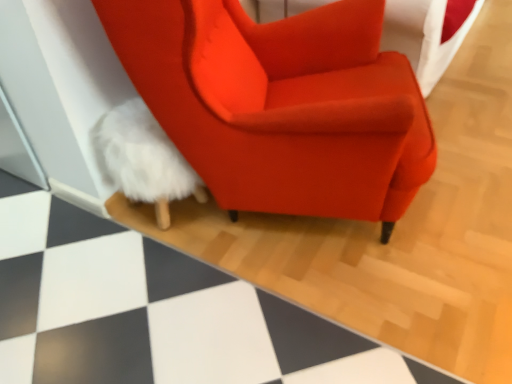
Image resolution: width=512 pixels, height=384 pixels. What do you see at coordinates (154, 312) in the screenshot? I see `white fluffy rug at lower left` at bounding box center [154, 312].

At what (x,y) coordinates should I click in order to perform the action: click on white fluffy rug at lower left. Please return your answer as a coordinate pair (x, y). Image resolution: width=512 pixels, height=384 pixels. Looking at the image, I should click on (154, 312).

In order to face satin orange armchair at center, should I rotate leftwards or rightwards?

It's best to rotate right around 4.509 degrees.

Where is `white fluffy rug at lower left`? white fluffy rug at lower left is located at coordinates (154, 312).

Is satin orange armchair at center inside the boundaries of white fluffy bean bag at lower left, or outside?

satin orange armchair at center is outside white fluffy bean bag at lower left.

Between satin orange armchair at center and white fluffy bean bag at lower left, which one has more height?

Standing taller between the two is satin orange armchair at center.

Which object is more forward, satin orange armchair at center or white fluffy bean bag at lower left?

satin orange armchair at center is in front.

Does satin orange armchair at center have a greater width compared to white fluffy bean bag at lower left?

Yes, satin orange armchair at center is wider than white fluffy bean bag at lower left.

Is white fluffy bean bag at lower left oriented towards satin orange armchair at center?

Yes, white fluffy bean bag at lower left is aimed at satin orange armchair at center.

Based on the photo, between white fluffy bean bag at lower left and satin orange armchair at center, which one has larger width?

satin orange armchair at center is wider.

Which of these two, white fluffy bean bag at lower left or satin orange armchair at center, stands shorter?

white fluffy bean bag at lower left is shorter.

Is point (129, 117) positioned in front of point (194, 88)?

No, (129, 117) is behind (194, 88).

From the image's perspective, which is above, white fluffy rug at lower left or white fluffy bean bag at lower left?

white fluffy rug at lower left is shown above in the image.

Is white fluffy rug at lower left further to the viewer compared to white fluffy bean bag at lower left?

No, the depth of white fluffy rug at lower left is less than that of white fluffy bean bag at lower left.

Is white fluffy rug at lower left placed right next to white fluffy bean bag at lower left?

No, white fluffy rug at lower left is not beside white fluffy bean bag at lower left.

How many degrees apart are the facing directions of white fluffy rug at lower left and white fluffy bean bag at lower left?

They differ by 2.08 degrees in their facing directions.

Looking at this image, which of these two, satin orange armchair at center or white fluffy rug at lower left, is wider?

white fluffy rug at lower left is wider.

Does point (382, 236) lie in front of point (258, 381)?

No.

Is satin orange armchair at center in contact with white fluffy rug at lower left?

No, satin orange armchair at center is not beside white fluffy rug at lower left.

From a real-world perspective, which object rests below the other?

white fluffy rug at lower left.

Considering the positions of objects white fluffy bean bag at lower left and white fluffy rug at lower left in the image provided, who is more to the left, white fluffy bean bag at lower left or white fluffy rug at lower left?

Positioned to the left is white fluffy bean bag at lower left.

Does point (134, 130) come farther from viewer compared to point (37, 313)?

Yes.

Considering the sizes of objects white fluffy bean bag at lower left and white fluffy rug at lower left in the image provided, who is bigger, white fluffy bean bag at lower left or white fluffy rug at lower left?

white fluffy rug at lower left is bigger.

Does white fluffy rug at lower left appear on the left side of satin orange armchair at center?

Incorrect, white fluffy rug at lower left is not on the left side of satin orange armchair at center.

Can you confirm if white fluffy rug at lower left is smaller than satin orange armchair at center?

Yes, white fluffy rug at lower left is smaller than satin orange armchair at center.

Which is in front, point (398, 357) or point (351, 111)?

The point (351, 111) is closer to the camera.

Where is `tile on the right of satin orange armchair at center`? This screenshot has width=512, height=384. tile on the right of satin orange armchair at center is located at coordinates (154, 312).

The image size is (512, 384). Find the location of `chair above the white fluffy bean bag at lower left (from the image's perspective)`. chair above the white fluffy bean bag at lower left (from the image's perspective) is located at coordinates (281, 104).

Find the location of a particular element. This screenshot has width=512, height=384. bean bag chair below the satin orange armchair at center (from the image's perspective) is located at coordinates click(143, 159).

Which object lies nearer to the anchor point satin orange armchair at center, white fluffy bean bag at lower left or white fluffy rug at lower left?

white fluffy bean bag at lower left is positioned closer to the anchor satin orange armchair at center.

Which object lies nearer to the anchor point white fluffy bean bag at lower left, satin orange armchair at center or white fluffy rug at lower left?

satin orange armchair at center is positioned closer to the anchor white fluffy bean bag at lower left.

Which object lies further to the anchor point white fluffy rug at lower left, satin orange armchair at center or white fluffy bean bag at lower left?

Among the two, satin orange armchair at center is located further to white fluffy rug at lower left.

Which object lies nearer to the anchor point white fluffy bean bag at lower left, white fluffy rug at lower left or satin orange armchair at center?

satin orange armchair at center is closer to white fluffy bean bag at lower left.

Looking at this image, looking at the image, which one is located closer to satin orange armchair at center, white fluffy rug at lower left or white fluffy bean bag at lower left?

white fluffy bean bag at lower left is closer to satin orange armchair at center.

Which object lies further to the anchor point white fluffy rug at lower left, white fluffy bean bag at lower left or satin orange armchair at center?

The object further to white fluffy rug at lower left is satin orange armchair at center.

The height and width of the screenshot is (384, 512). Identify the location of chair situated between white fluffy bean bag at lower left and white fluffy rug at lower left from left to right. (281, 104).